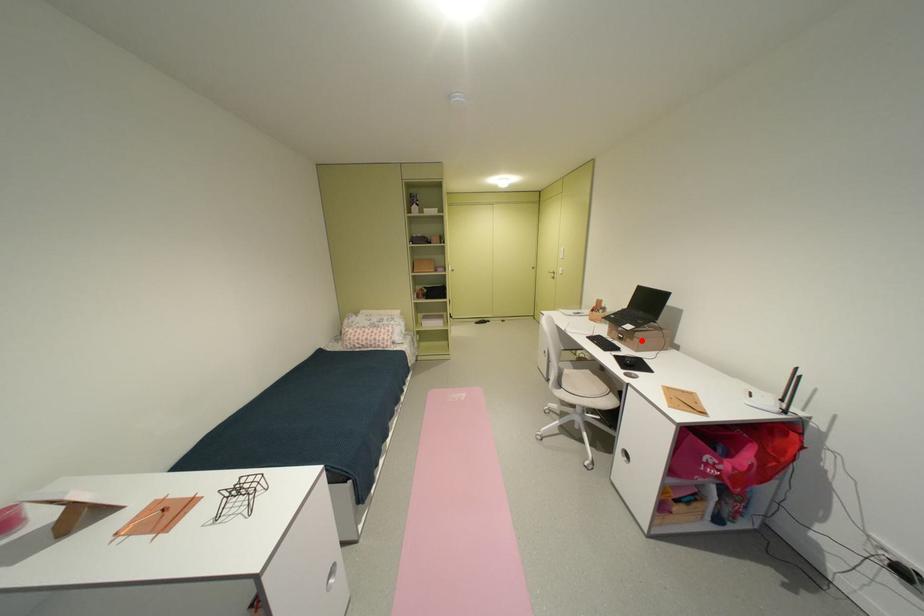
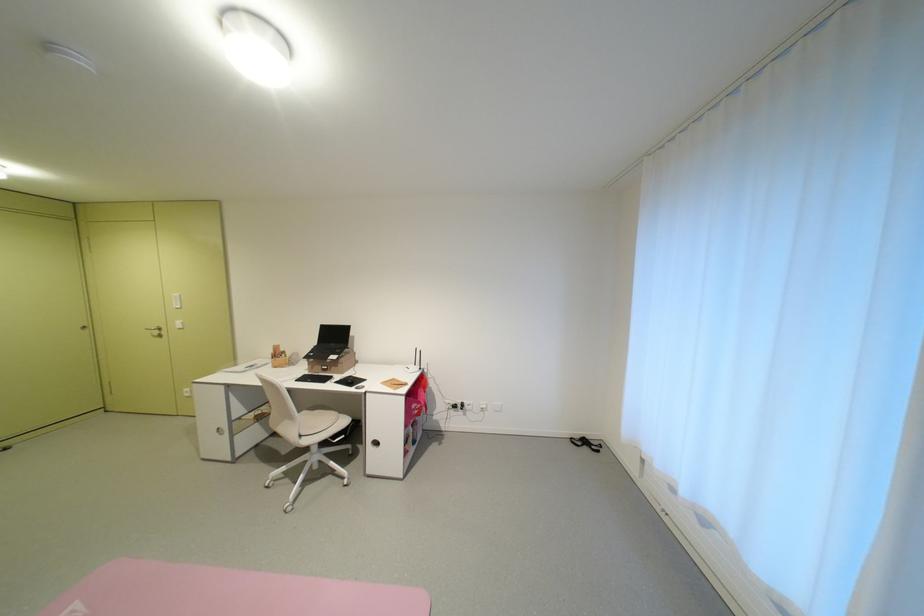
Locate, in the second image, the point that corresponds to the highlighted location in the first image.

(346, 368)